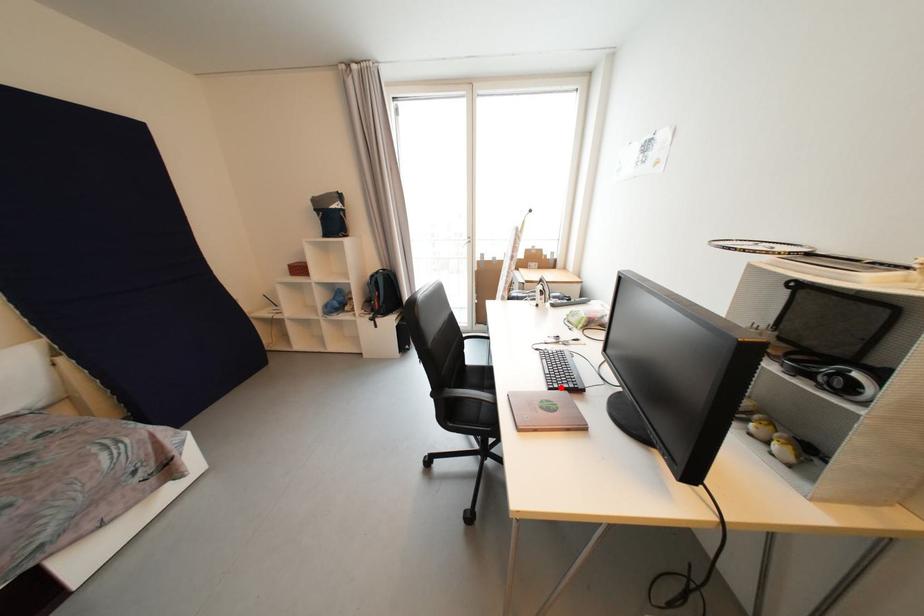
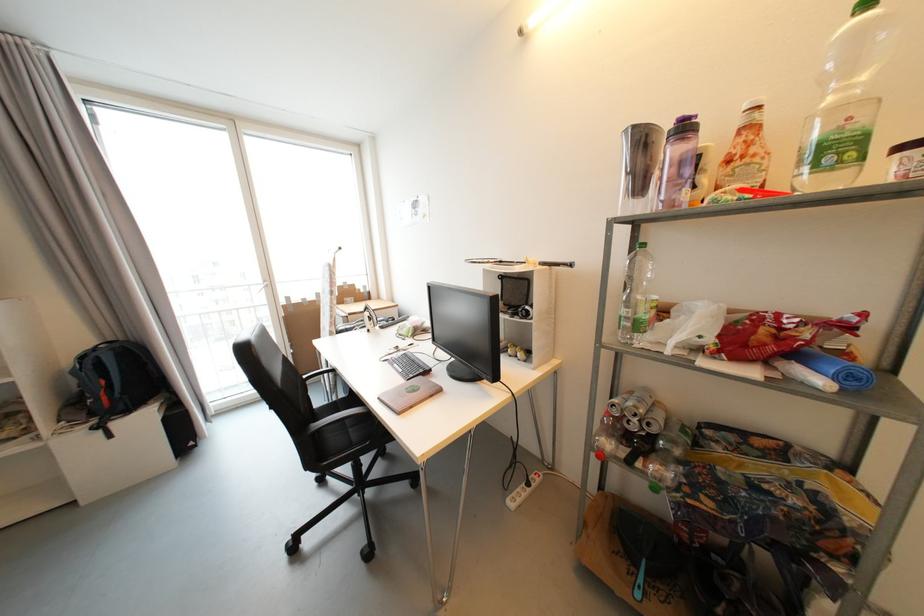
Where in the second image is the point corresponding to the highlighted location from the first image?

(417, 378)